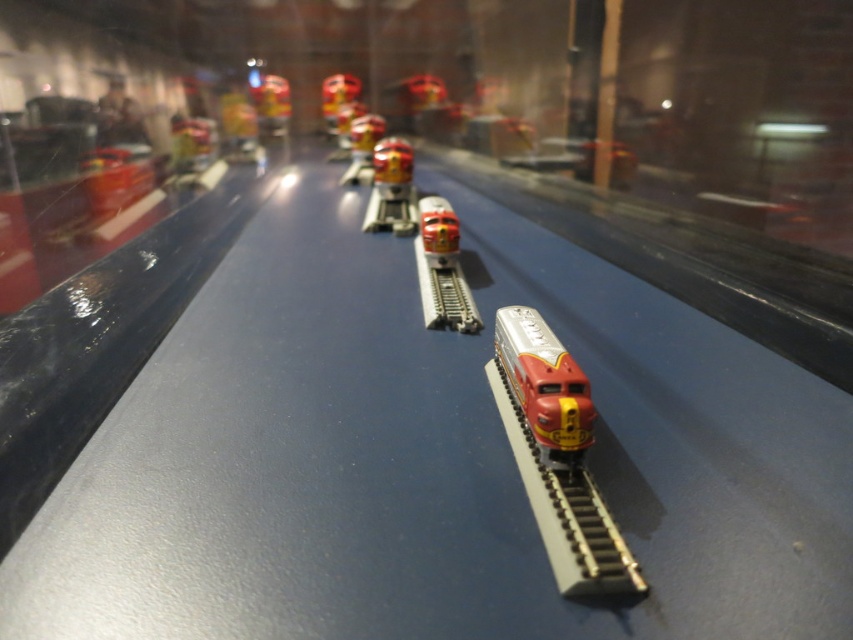
Does shiny silver train at center have a greater height compared to metallic red train at center?

No, shiny silver train at center is not taller than metallic red train at center.

Is shiny silver train at center wider than metallic red train at center?

No, shiny silver train at center is not wider than metallic red train at center.

Who is more distant from viewer, (575, 465) or (352, 173)?

Point (352, 173)

In order to click on shiny silver train at center in this screenshot , I will do `click(544, 387)`.

Does glossy plastic train at center have a lesser height compared to shiny red train at upper center?

Yes.

Is glossy plastic train at center to the left of shiny red train at upper center from the viewer's perspective?

Indeed, glossy plastic train at center is positioned on the left side of shiny red train at upper center.

Locate an element on the screen. glossy plastic train at center is located at coordinates (238, 125).

I want to click on glossy plastic train at center, so click(x=238, y=125).

Measure the distance from shiny metallic train at center to glossy red train at center.

shiny metallic train at center is 9.02 inches away from glossy red train at center.

Does point (413, 209) come closer to viewer compared to point (434, 250)?

No, (413, 209) is further to viewer.

Where is `shiny metallic train at center`? shiny metallic train at center is located at coordinates (392, 188).